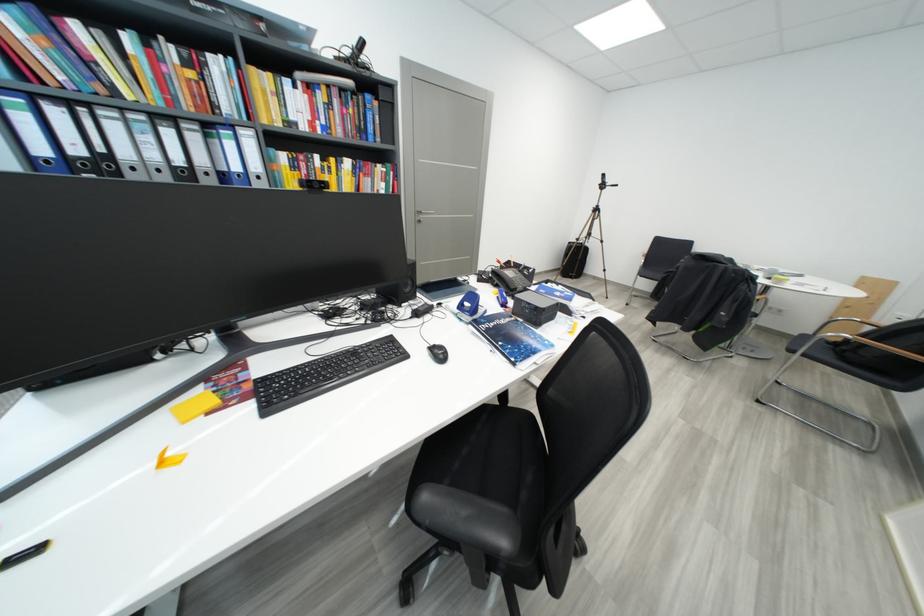
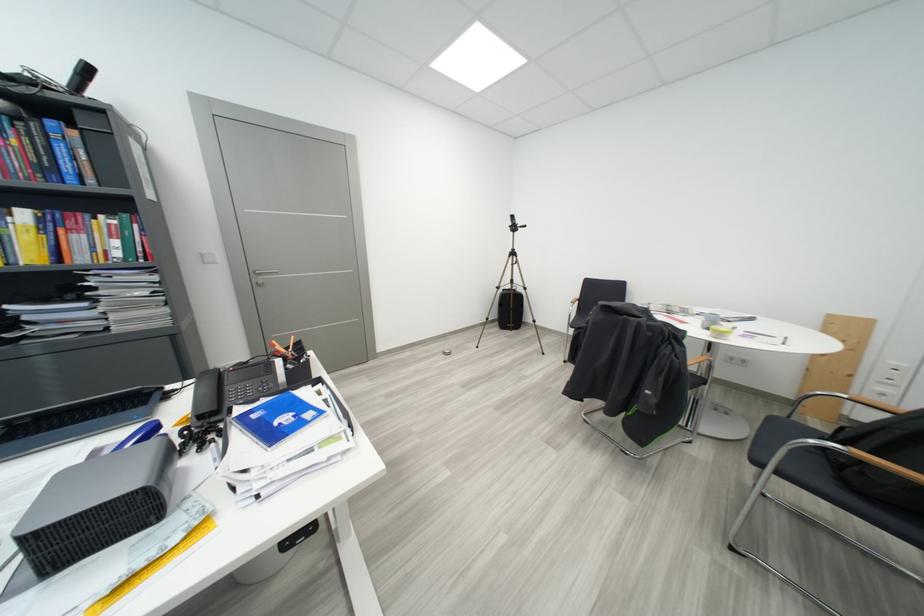
Where in the second image is the point corresponding to pixel 800 354 from the first image?

(767, 466)